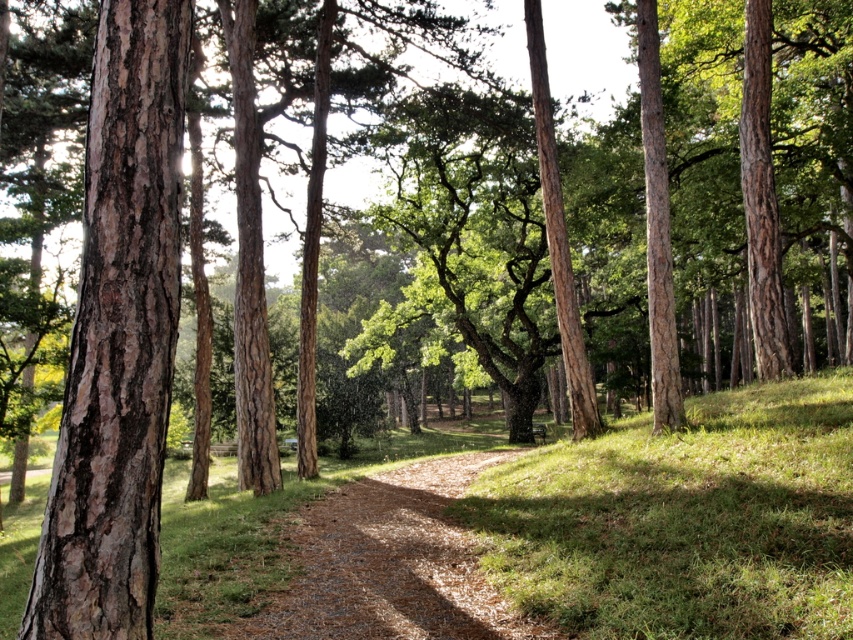
Question: Among these points, which one is nearest to the camera?

Choices:
 (A) (433, 476)
 (B) (50, 624)

Answer: (B)

Question: Which point appears closest to the camera in this image?

Choices:
 (A) (131, 243)
 (B) (347, 582)

Answer: (A)

Question: Does smooth brown bark at left have a lesser width compared to brown gravel path at center?

Choices:
 (A) no
 (B) yes

Answer: (B)

Question: Can you confirm if smooth brown bark at left is positioned below brown gravel path at center?

Choices:
 (A) no
 (B) yes

Answer: (A)

Question: Can you confirm if smooth brown bark at left is positioned below brown gravel path at center?

Choices:
 (A) no
 (B) yes

Answer: (A)

Question: Which point appears farthest from the camera in this image?

Choices:
 (A) (462, 545)
 (B) (165, 378)

Answer: (A)